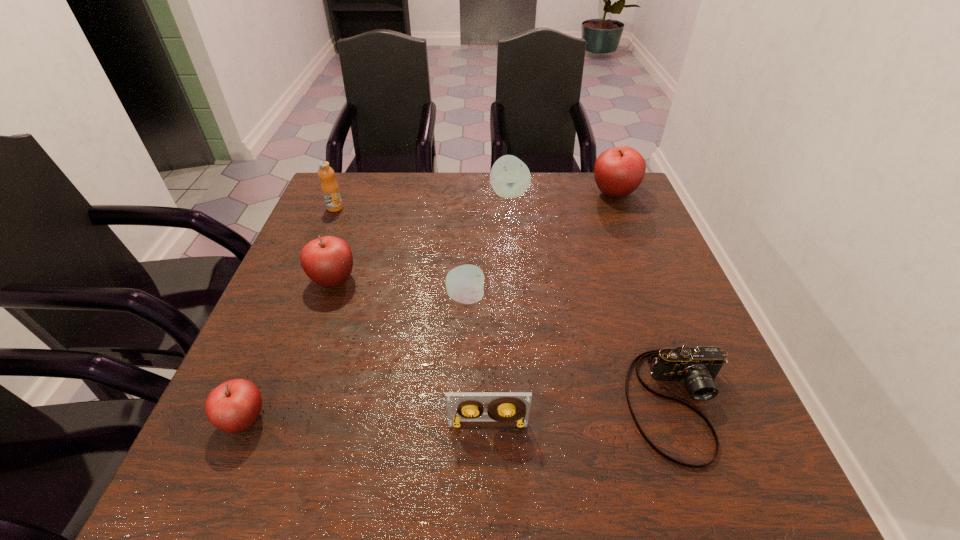
Where is `the rightmost red apple`? This screenshot has height=540, width=960. the rightmost red apple is located at coordinates (618, 171).

Where is `the farthest red apple`? This screenshot has width=960, height=540. the farthest red apple is located at coordinates (618, 171).

You are a GUI agent. You are given a task and a screenshot of the screen. Output one action in this format:
    pyautogui.click(x=<x>, y=<y>)
    Task: Click on the orange juice
    The width and height of the screenshot is (960, 540).
    Given the screenshot: What is the action you would take?
    pyautogui.click(x=330, y=189)

Identify the location of the right white apple. This screenshot has width=960, height=540. (509, 177).

Locate an element on the screen. This screenshot has width=960, height=540. the fourth apple from left to right is located at coordinates (509, 177).

Where is `the second biggest red apple`? the second biggest red apple is located at coordinates (328, 261).

The width and height of the screenshot is (960, 540). Find the location of `the smaller white apple`. the smaller white apple is located at coordinates (465, 283).

Locate an element on the screen. This screenshot has height=540, width=960. the left white apple is located at coordinates (465, 283).

Identify the location of the nearest red apple. (234, 406).

The height and width of the screenshot is (540, 960). Find the location of `the smallest red apple`. the smallest red apple is located at coordinates (234, 406).